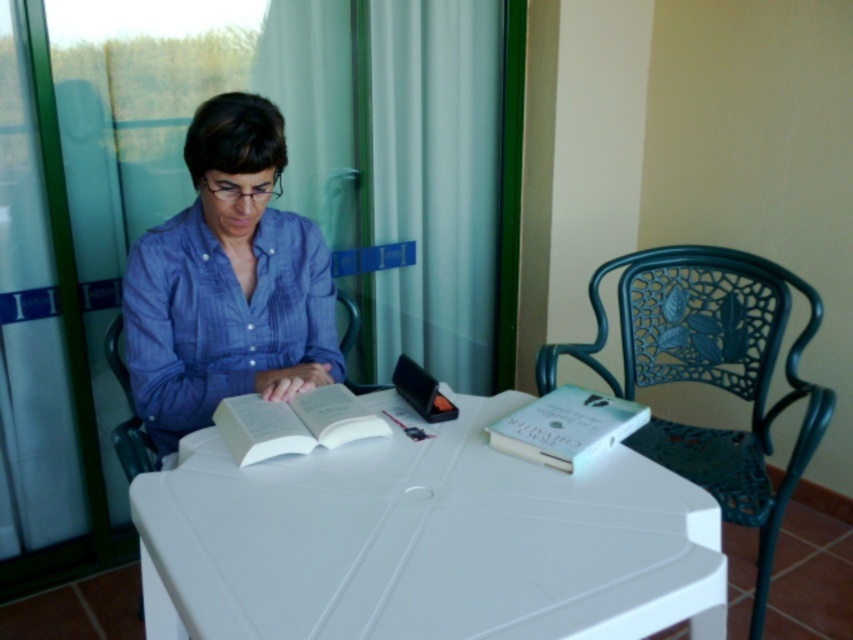
You are trying to move the white plastic table at center to the location of the transparent glass door at upper left. Based on their sizes, will the table fit through the door without needing to be disassembled?

The white plastic table at center might be wider than transparent glass door at upper left, so there is a possibility that it won not fit through the door without adjustments.

You are a person who is 1.7 meters tall. You want to sit on one of the chairs in the scene. Which chair would allow you to comfortably place your feet on the floor without straining your legs? Please choose between the green wrought iron chair at right and the metallic blue chair at left.

The metallic blue chair at left is shorter than the green wrought iron chair at right, so choosing the metallic blue chair at left would allow you to comfortably place your feet on the floor without straining your legs.